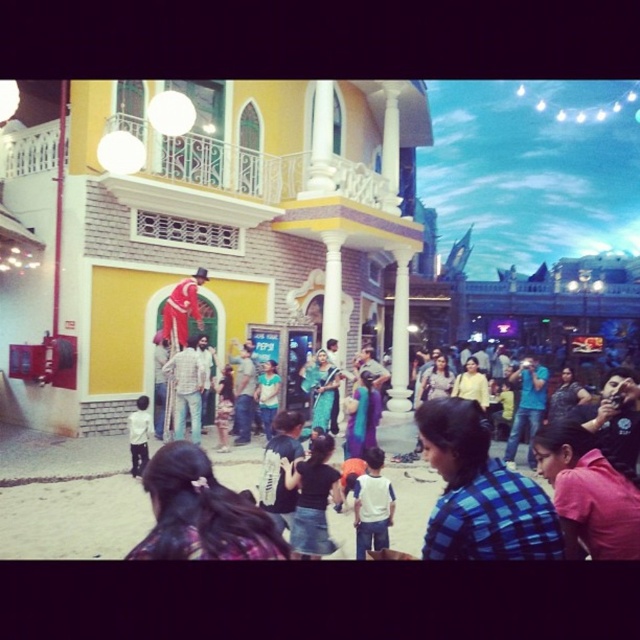
You are a photographer at the amusement park and want to capture both the blue checkered shirt at center and the dark brown hair at lower center in a single photo. Which object should you focus on first to ensure both are in frame?

The blue checkered shirt at center is smaller than dark brown hair at lower center, so you should focus on the dark brown hair at lower center first to ensure both are in frame.

You are standing in the amusement park and want to take a photo that includes both the point at coordinates point (141, 154) and the point at coordinates point (362, 493). Since one is closer to you than the other, which point should you focus on to ensure both are in focus?

You should focus on point (141, 154) because it is closer to you, and adjusting the focus to this point will keep both points in focus as the one further away will still be within the depth of field.

You are a photographer at the amusement park and want to capture both the blue checkered shirt at center and the dark brown hair at lower center in the same frame. Which object should you focus on first to ensure both are in the frame?

You should focus on the dark brown hair at lower center first because it is taller than the blue checkered shirt at center, allowing the photographer to adjust the frame to include both.